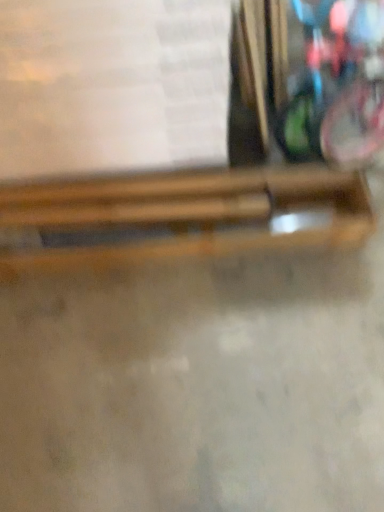
Question: Which direction should I rotate to face wooden chopsticks at center, which is counted as the second wood, starting from the top, — up or down?

Choices:
 (A) up
 (B) down

Answer: (A)

Question: Is white paper at upper center at the back of wooden chopsticks at center, which is the first wood in top-to-bottom order?

Choices:
 (A) no
 (B) yes

Answer: (B)

Question: Is wooden chopsticks at center, the second wood in the bottom-to-top sequence, next to white paper at upper center and touching it?

Choices:
 (A) yes
 (B) no

Answer: (B)

Question: Considering the relative positions of wooden chopsticks at center, the second wood in the bottom-to-top sequence, and white paper at upper center in the image provided, is wooden chopsticks at center, the second wood in the bottom-to-top sequence, behind white paper at upper center?

Choices:
 (A) no
 (B) yes

Answer: (B)

Question: From the image's perspective, is wooden chopsticks at center, which is the first wood in top-to-bottom order, beneath white paper at upper center?

Choices:
 (A) yes
 (B) no

Answer: (A)

Question: Is wooden chopsticks at center, which is the first wood in top-to-bottom order, facing towards white paper at upper center?

Choices:
 (A) no
 (B) yes

Answer: (A)

Question: From a real-world perspective, is wooden chopsticks at center, the second wood in the bottom-to-top sequence, physically below white paper at upper center?

Choices:
 (A) yes
 (B) no

Answer: (A)

Question: Does wooden chopsticks at center, which is the first wood in top-to-bottom order, touch wooden chopsticks at center, which is the 1th wood from bottom to top?

Choices:
 (A) no
 (B) yes

Answer: (B)

Question: Can you confirm if wooden chopsticks at center, the second wood in the bottom-to-top sequence, is positioned to the right of wooden chopsticks at center, which is counted as the second wood, starting from the top?

Choices:
 (A) yes
 (B) no

Answer: (B)

Question: Is wooden chopsticks at center, which is the first wood in top-to-bottom order, wider than wooden chopsticks at center, which is counted as the second wood, starting from the top?

Choices:
 (A) yes
 (B) no

Answer: (B)

Question: Are wooden chopsticks at center, which is the first wood in top-to-bottom order, and wooden chopsticks at center, which is the 1th wood from bottom to top, far apart?

Choices:
 (A) yes
 (B) no

Answer: (B)

Question: Is wooden chopsticks at center, which is the first wood in top-to-bottom order, aimed at wooden chopsticks at center, which is counted as the second wood, starting from the top?

Choices:
 (A) no
 (B) yes

Answer: (B)

Question: Is wooden chopsticks at center, which is the first wood in top-to-bottom order, positioned with its back to wooden chopsticks at center, which is counted as the second wood, starting from the top?

Choices:
 (A) no
 (B) yes

Answer: (B)

Question: From the image's perspective, is white paper at upper center on wooden chopsticks at center, which is the first wood in top-to-bottom order?

Choices:
 (A) yes
 (B) no

Answer: (A)